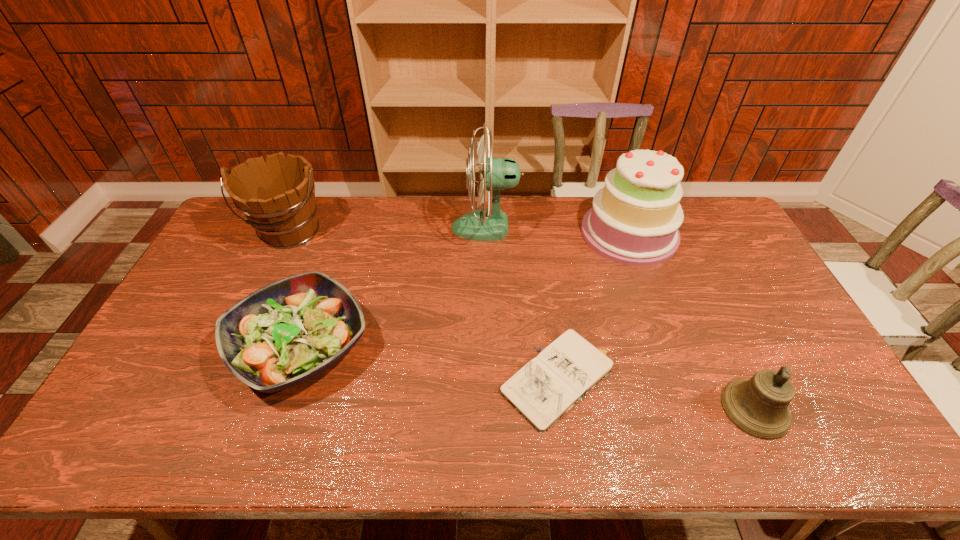
The width and height of the screenshot is (960, 540). What are the coordinates of `object positioned at the right edge` in the screenshot? It's located at (758, 406).

You are a GUI agent. You are given a task and a screenshot of the screen. Output one action in this format:
    pyautogui.click(x=<x>, y=<y>)
    Task: Click on the object situated at the far left corner
    The width and height of the screenshot is (960, 540).
    Given the screenshot: What is the action you would take?
    pyautogui.click(x=277, y=196)

I want to click on object at the near right corner, so click(x=758, y=406).

This screenshot has height=540, width=960. In the image, there is a desktop. In order to click on free space at the far edge in this screenshot , I will do `click(582, 212)`.

Locate an element on the screen. free space at the near edge is located at coordinates (658, 437).

Locate an element on the screen. Image resolution: width=960 pixels, height=540 pixels. free space at the left edge of the desktop is located at coordinates (181, 325).

This screenshot has width=960, height=540. In the image, there is a desktop. What are the coordinates of `vacant region at the right edge` in the screenshot? It's located at (722, 289).

Find the location of a particular element. vacant space at the far right corner of the desktop is located at coordinates pyautogui.click(x=716, y=228).

Identify the location of free spot at the near right corner of the desktop. The height and width of the screenshot is (540, 960). (815, 434).

Where is `vacant space that is in between the fan and the notebook`? This screenshot has width=960, height=540. vacant space that is in between the fan and the notebook is located at coordinates (523, 304).